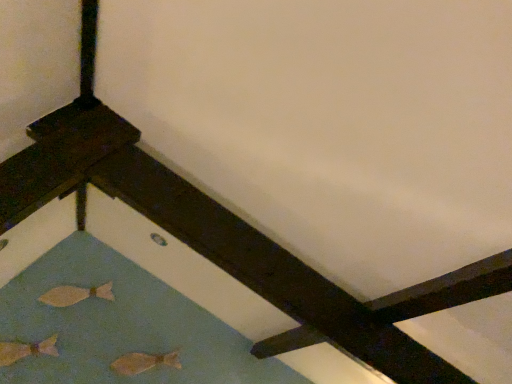
Question: Is matte beige fish at lower left, which is the first fish from top to bottom, bigger or smaller than matte gold fish at lower left, which ranks as the 1th fish in left-to-right order?

Choices:
 (A) big
 (B) small

Answer: (B)

Question: In terms of height, does matte beige fish at lower left, the 2th fish viewed from the right, look taller or shorter compared to matte gold fish at lower left, which ranks as the 1th fish in left-to-right order?

Choices:
 (A) tall
 (B) short

Answer: (B)

Question: Based on their relative distances, which object is nearer to the matte gold fish at lower left, positioned as the 3th fish in right-to-left order?

Choices:
 (A) matte beige fish at lower left, acting as the third fish starting from the bottom
 (B) matte beige fish at lower left, which is the third fish in left-to-right order

Answer: (A)

Question: Which object is the farthest from the matte beige fish at lower left, which ranks as the 2th fish in left-to-right order?

Choices:
 (A) matte beige fish at lower left, which is the 3th fish from top to bottom
 (B) matte gold fish at lower left, which ranks as the 1th fish in left-to-right order

Answer: (A)